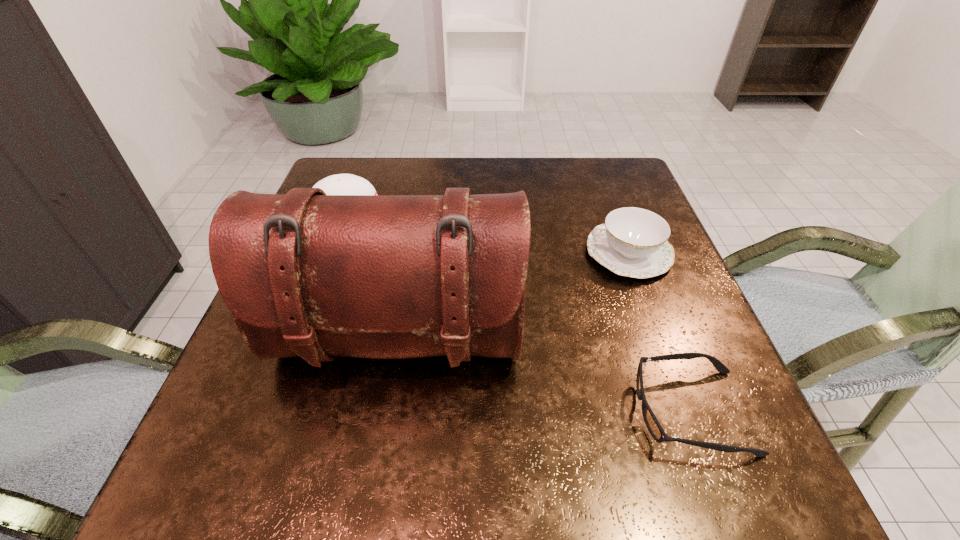
Locate an element on the screen. The height and width of the screenshot is (540, 960). blank space located 0.100m on the front-facing side of the shortest object is located at coordinates (573, 411).

Locate an element on the screen. This screenshot has width=960, height=540. free region located on the front-facing side of the shortest object is located at coordinates (466, 411).

The height and width of the screenshot is (540, 960). Identify the location of object that is positioned at the far edge. (340, 184).

You are a GUI agent. You are given a task and a screenshot of the screen. Output one action in this format:
    pyautogui.click(x=<x>, y=<y>)
    Task: Click on the object that is at the near edge
    Image resolution: width=960 pixels, height=540 pixels.
    Given the screenshot: What is the action you would take?
    (x=652, y=424)

I want to click on satchel located in the left edge section of the desktop, so click(306, 274).

The height and width of the screenshot is (540, 960). I want to click on baseball cap that is at the left edge, so click(340, 184).

Identify the location of chinaware that is at the right edge. Image resolution: width=960 pixels, height=540 pixels. (633, 242).

The width and height of the screenshot is (960, 540). Find the location of `spectacles located at the right edge`. spectacles located at the right edge is located at coordinates (652, 424).

In order to click on object positioned at the far left corner in this screenshot , I will do `click(340, 184)`.

At what (x,y) coordinates should I click in order to perform the action: click on object that is positioned at the near right corner. Please return your answer as a coordinate pair (x, y). Looking at the image, I should click on (652, 424).